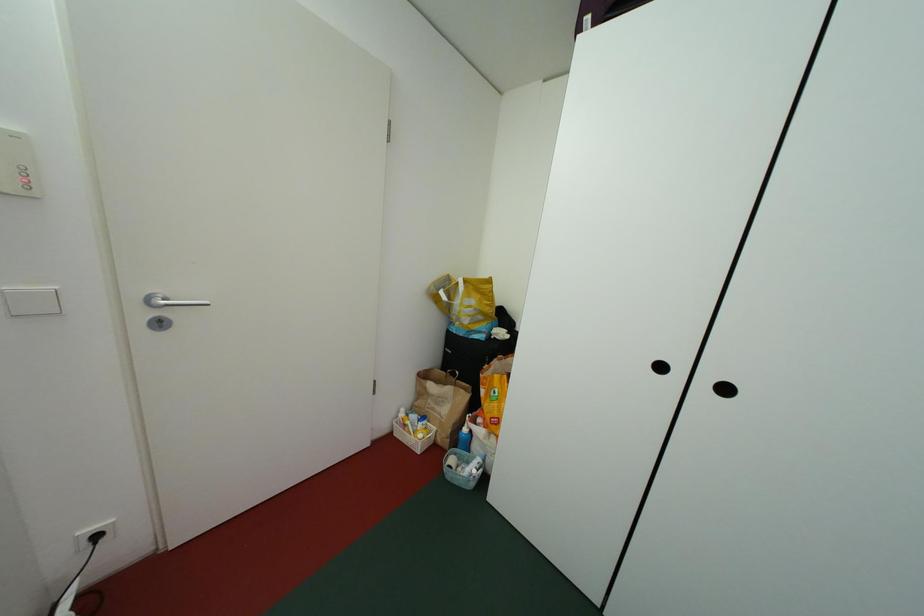
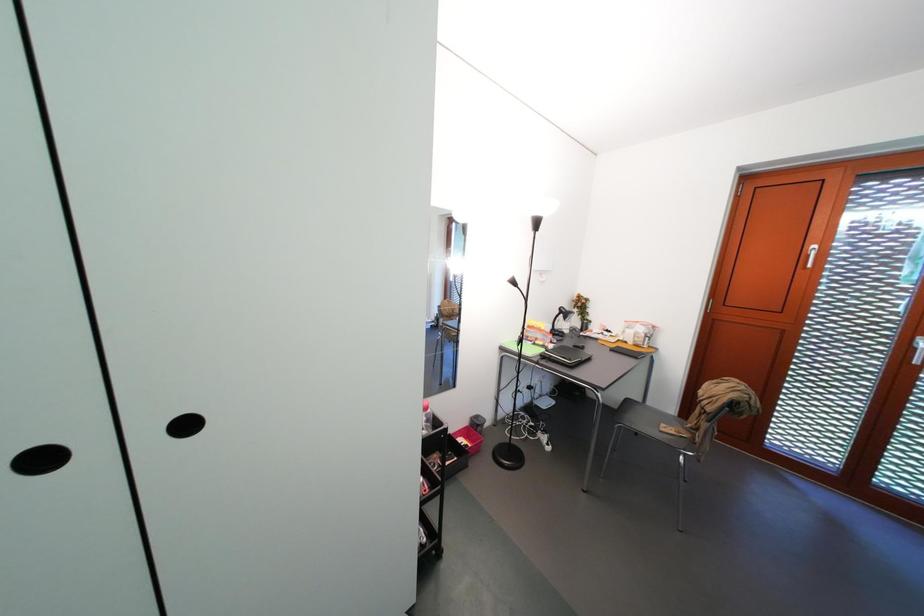
The images are taken continuously from a first-person perspective. In which direction is your viewpoint rotating?

The rotation direction of the camera is right-down.